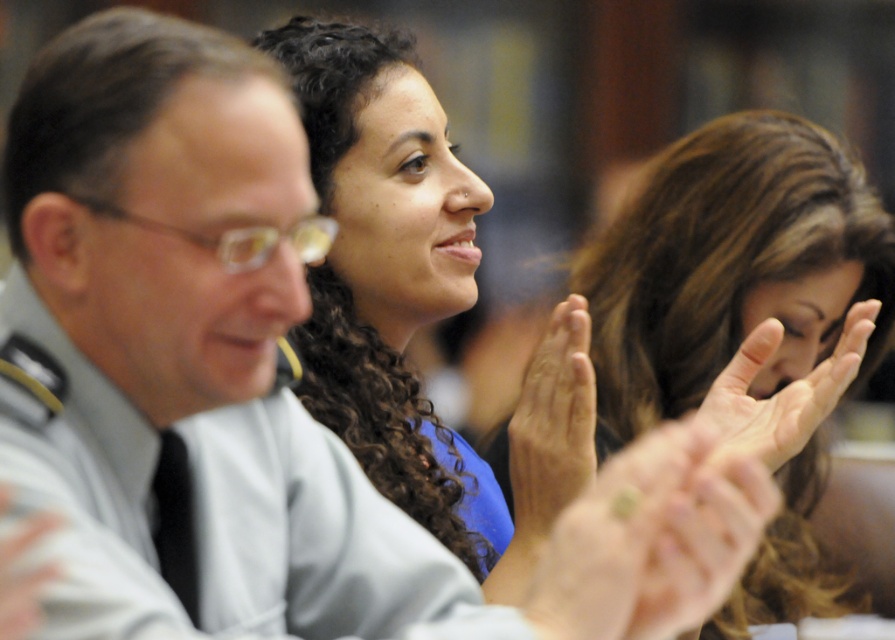
Question: Which object is positioned closest to the smooth skin hand at center?

Choices:
 (A) gray uniform at center
 (B) white matte hand at center
 (C) smooth brown hair at center
 (D) green painted fingernail at center

Answer: (D)

Question: Can you confirm if green painted fingernail at center is wider than dry skin at center?

Choices:
 (A) yes
 (B) no

Answer: (A)

Question: Does gray uniform at center have a lesser width compared to smooth brown hair at center?

Choices:
 (A) no
 (B) yes

Answer: (B)

Question: Which point is closer to the camera taking this photo?

Choices:
 (A) (527, 448)
 (B) (740, 560)
 (C) (406, 620)

Answer: (B)

Question: Does green painted fingernail at center appear on the right side of smooth skin hand at center?

Choices:
 (A) yes
 (B) no

Answer: (B)

Question: Which of the following is the farthest from the observer?

Choices:
 (A) (0, 394)
 (B) (9, 609)

Answer: (A)